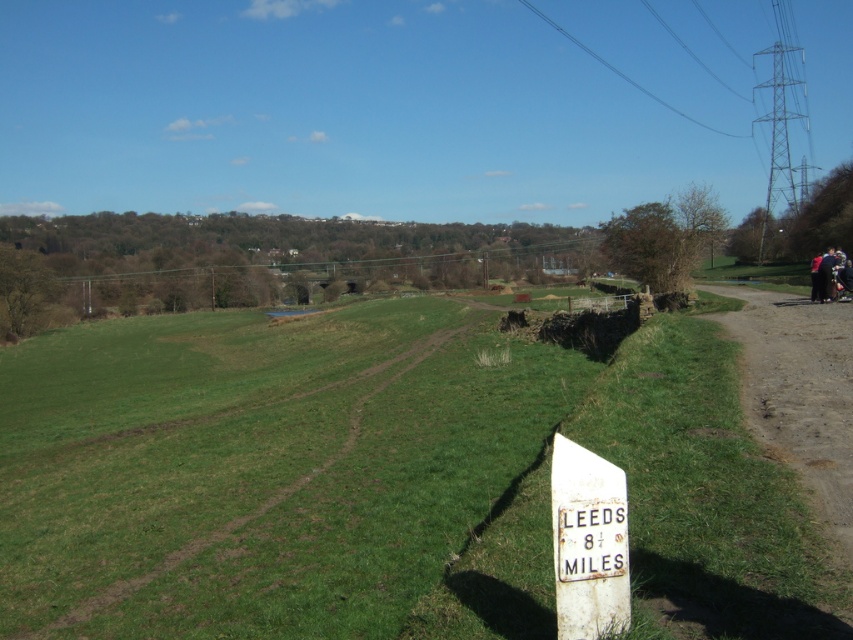
Question: Is brown wooden power line at upper center above white weathered signpost at lower right?

Choices:
 (A) yes
 (B) no

Answer: (A)

Question: Which of these objects is positioned farthest from the white weathered signpost at lower right?

Choices:
 (A) green grassy at lower left
 (B) brown wooden power line at upper center

Answer: (B)

Question: In this image, where is green grassy at lower left located relative to brown wooden power line at upper center?

Choices:
 (A) right
 (B) left

Answer: (A)

Question: From the image, what is the correct spatial relationship of brown wooden power line at upper center in relation to white weathered signpost at lower right?

Choices:
 (A) above
 (B) below

Answer: (A)

Question: Which point appears farthest from the camera in this image?

Choices:
 (A) (293, 259)
 (B) (244, 522)
 (C) (582, 506)

Answer: (A)

Question: Which object is positioned farthest from the white weathered signpost at lower right?

Choices:
 (A) green grassy at lower left
 (B) brown wooden power line at upper center

Answer: (B)